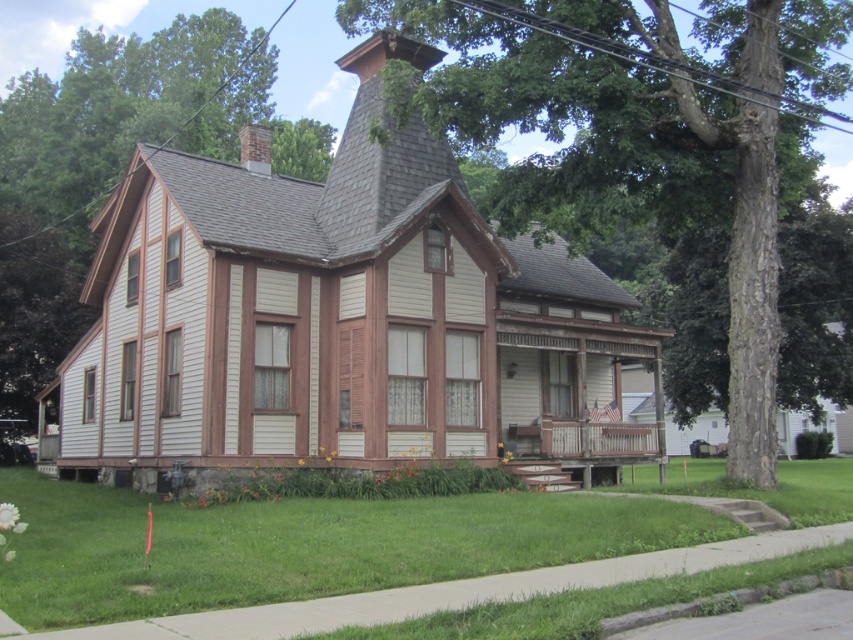
You are standing on the porch of the Victorian house and notice two elements in the scene. One is the smooth brown bark at center and the other is the green leafy tree at left. Which object is positioned lower in the scene?

The smooth brown bark at center is located below the green leafy tree at left, so it is positioned lower in the scene.

You are a gardener planning to plant a new tree in the yard of the Victorian house. You have two options based on the image you see. The first option is to plant a tree with smooth brown bark at center, and the second option is to plant a green leafy tree at left. Considering the existing trees in the scene, which tree would require less space vertically when fully grown?

The smooth brown bark at center is shorter than the green leafy tree at left, so planting the smooth brown bark at center would require less vertical space when fully grown.

You are standing in the front yard of the Victorian house and notice the smooth brown bark at center and the green leafy tree at left. Which object takes up more space in the scene?

The green leafy tree at left occupies more space than the smooth brown bark at center.